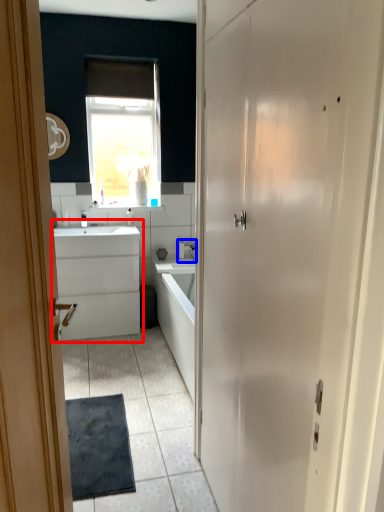
Question: Which object appears farthest to the camera in this image, bathroom cabinet (highlighted by a red box) or tap (highlighted by a blue box)?

Choices:
 (A) bathroom cabinet
 (B) tap

Answer: (B)